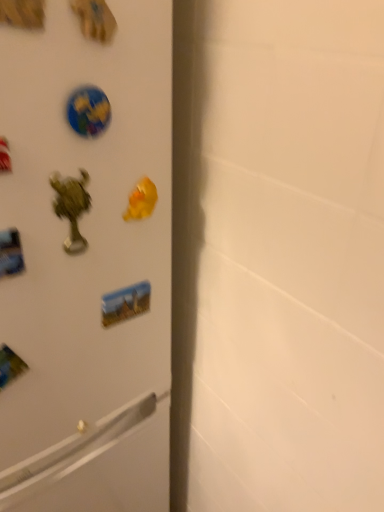
How much space does glossy plastic globe at upper left, the 2th sticker in the bottom-to-top sequence, occupy horizontally?

0.39 inches.

Describe the element at coordinates (85, 263) in the screenshot. Image resolution: width=384 pixels, height=512 pixels. I see `white matte refrigerator at left` at that location.

The width and height of the screenshot is (384, 512). Identify the location of white matte refrigerator at left. (85, 263).

Image resolution: width=384 pixels, height=512 pixels. Identify the location of matte plastic sticker at center, the 2th sticker positioned from the front. (125, 303).

Does point (143, 442) appear closer or farther from the camera than point (97, 120)?

Point (143, 442) is farther from the camera than point (97, 120).

From a real-world perspective, relative to glossy plastic globe at upper left, the 2th sticker in the bottom-to-top sequence, is white matte refrigerator at left vertically above or below?

From a real-world perspective, white matte refrigerator at left is physically below glossy plastic globe at upper left, the 2th sticker in the bottom-to-top sequence.

Are white matte refrigerator at left and glossy plastic globe at upper left, positioned as the 1th sticker in front-to-back order, located far from each other?

Actually, white matte refrigerator at left and glossy plastic globe at upper left, positioned as the 1th sticker in front-to-back order, are a little close together.

Is white matte refrigerator at left positioned far away from gold metallic magnet at center?

They are positioned close to each other.

Is the depth of white matte refrigerator at left greater than that of gold metallic magnet at center?

No, white matte refrigerator at left is closer to the camera.

Is white matte refrigerator at left completely or partially outside of gold metallic magnet at center?

white matte refrigerator at left lies outside gold metallic magnet at center's area.

Does gold metallic magnet at center come in front of matte plastic sticker at center, positioned as the 1th sticker in back-to-front order?

Yes, gold metallic magnet at center is closer to the camera.

Is gold metallic magnet at center thinner than matte plastic sticker at center, the 1th sticker ordered from the bottom?

Incorrect, the width of gold metallic magnet at center is not less than that of matte plastic sticker at center, the 1th sticker ordered from the bottom.

From a real-world perspective, is gold metallic magnet at center located higher than matte plastic sticker at center, the 2th sticker from the top?

Yes, from a real-world perspective, gold metallic magnet at center is above matte plastic sticker at center, the 2th sticker from the top.

The image size is (384, 512). Identify the location of sticker on the left of the matte plastic sticker at center, the 2th sticker from the top. tap(88, 111).

Which object is positioned more to the right, glossy plastic globe at upper left, positioned as the 1th sticker in front-to-back order, or matte plastic sticker at center, positioned as the 1th sticker in back-to-front order?

matte plastic sticker at center, positioned as the 1th sticker in back-to-front order, is more to the right.

How different are the orientations of glossy plastic globe at upper left, positioned as the 1th sticker in front-to-back order, and matte plastic sticker at center, positioned as the 1th sticker in back-to-front order, in degrees?

1.34 degrees.

Is glossy plastic globe at upper left, the 2th sticker in the bottom-to-top sequence, in front of or behind matte plastic sticker at center, the 2th sticker positioned from the front, in the image?

Clearly, glossy plastic globe at upper left, the 2th sticker in the bottom-to-top sequence, is in front of matte plastic sticker at center, the 2th sticker positioned from the front.

Can you tell me how much matte plastic sticker at center, the 1th sticker ordered from the bottom, and gold metallic magnet at center differ in facing direction?

5.99 degrees.

From the image's perspective, relative to gold metallic magnet at center, is matte plastic sticker at center, the 2th sticker positioned from the front, above or below?

From the image's perspective, matte plastic sticker at center, the 2th sticker positioned from the front, appears below gold metallic magnet at center.

Is matte plastic sticker at center, the 1th sticker ordered from the bottom, wider than gold metallic magnet at center?

Incorrect, the width of matte plastic sticker at center, the 1th sticker ordered from the bottom, does not surpass that of gold metallic magnet at center.

Does white matte refrigerator at left have a lesser width compared to matte plastic sticker at center, the 1th sticker ordered from the bottom?

In fact, white matte refrigerator at left might be wider than matte plastic sticker at center, the 1th sticker ordered from the bottom.

From a real-world perspective, is white matte refrigerator at left physically below matte plastic sticker at center, the 1th sticker ordered from the bottom?

No, from a real-world perspective, white matte refrigerator at left is not under matte plastic sticker at center, the 1th sticker ordered from the bottom.

At what (x,y) coordinates should I click in order to perform the action: click on sticker that is the 2nd one when counting rightward from the white matte refrigerator at left. Please return your answer as a coordinate pair (x, y). This screenshot has height=512, width=384. Looking at the image, I should click on (125, 303).

Based on the photo, is white matte refrigerator at left facing towards matte plastic sticker at center, positioned as the 1th sticker in back-to-front order?

Yes, white matte refrigerator at left is facing matte plastic sticker at center, positioned as the 1th sticker in back-to-front order.

Image resolution: width=384 pixels, height=512 pixels. Identify the location of sticker that is the 1st one when counting backward from the white matte refrigerator at left. (88, 111).

Is glossy plastic globe at upper left, marked as the 1th sticker in a top-to-bottom arrangement, looking in the opposite direction of white matte refrigerator at left?

Yes, glossy plastic globe at upper left, marked as the 1th sticker in a top-to-bottom arrangement,'s orientation is away from white matte refrigerator at left.

From a real-world perspective, is glossy plastic globe at upper left, marked as the 1th sticker in a top-to-bottom arrangement, on top of white matte refrigerator at left?

Yes.

Identify the location of refrigerator located underneath the glossy plastic globe at upper left, positioned as the 1th sticker in front-to-back order (from a real-world perspective). Image resolution: width=384 pixels, height=512 pixels. (85, 263).

At what (x,y) coordinates should I click in order to perform the action: click on refrigerator on the left of the gold metallic magnet at center. Please return your answer as a coordinate pair (x, y). This screenshot has width=384, height=512. Looking at the image, I should click on (85, 263).

Looking at the image, which one is located closer to white matte refrigerator at left, matte plastic sticker at center, the 2th sticker from the top, or glossy plastic globe at upper left, positioned as the 1th sticker in front-to-back order?

matte plastic sticker at center, the 2th sticker from the top, lies closer to white matte refrigerator at left than the other object.

From the image, which object appears to be nearer to white matte refrigerator at left, matte plastic sticker at center, the 2th sticker from the top, or gold metallic magnet at center?

Among the two, matte plastic sticker at center, the 2th sticker from the top, is located nearer to white matte refrigerator at left.

Looking at the image, which one is located further to gold metallic magnet at center, matte plastic sticker at center, positioned as the 1th sticker in back-to-front order, or white matte refrigerator at left?

The object further to gold metallic magnet at center is white matte refrigerator at left.

Based on their spatial positions, is white matte refrigerator at left or glossy plastic globe at upper left, the 2th sticker in the bottom-to-top sequence, closer to matte plastic sticker at center, the 1th sticker ordered from the bottom?

The object closer to matte plastic sticker at center, the 1th sticker ordered from the bottom, is white matte refrigerator at left.

In the scene shown: From the image, which object appears to be nearer to gold metallic magnet at center, matte plastic sticker at center, the 2th sticker positioned from the front, or glossy plastic globe at upper left, the 2th sticker in the bottom-to-top sequence?

glossy plastic globe at upper left, the 2th sticker in the bottom-to-top sequence, lies closer to gold metallic magnet at center than the other object.

Consider the image. Considering their positions, is white matte refrigerator at left positioned closer to matte plastic sticker at center, the 1th sticker ordered from the bottom, than gold metallic magnet at center?

gold metallic magnet at center is closer to matte plastic sticker at center, the 1th sticker ordered from the bottom.

Which object lies nearer to the anchor point glossy plastic globe at upper left, positioned as the 1th sticker in front-to-back order, gold metallic magnet at center or white matte refrigerator at left?

gold metallic magnet at center.

From the image, which object appears to be nearer to glossy plastic globe at upper left, positioned as the 1th sticker in front-to-back order, matte plastic sticker at center, the 2th sticker positioned from the front, or white matte refrigerator at left?

Among the two, matte plastic sticker at center, the 2th sticker positioned from the front, is located nearer to glossy plastic globe at upper left, positioned as the 1th sticker in front-to-back order.

Locate an element on the screen. This screenshot has height=512, width=384. sticker between white matte refrigerator at left and gold metallic magnet at center from front to back is located at coordinates (88, 111).

Where is `magnet between white matte refrigerator at left and matte plastic sticker at center, the 2th sticker from the top, in the front-back direction`? Image resolution: width=384 pixels, height=512 pixels. magnet between white matte refrigerator at left and matte plastic sticker at center, the 2th sticker from the top, in the front-back direction is located at coordinates (141, 200).

At what (x,y) coordinates should I click in order to perform the action: click on sticker located between white matte refrigerator at left and matte plastic sticker at center, the 1th sticker ordered from the bottom, in the depth direction. Please return your answer as a coordinate pair (x, y). The image size is (384, 512). Looking at the image, I should click on (88, 111).

I want to click on magnet between glossy plastic globe at upper left, marked as the 1th sticker in a top-to-bottom arrangement, and matte plastic sticker at center, the 2th sticker from the top, in the up-down direction, so click(141, 200).